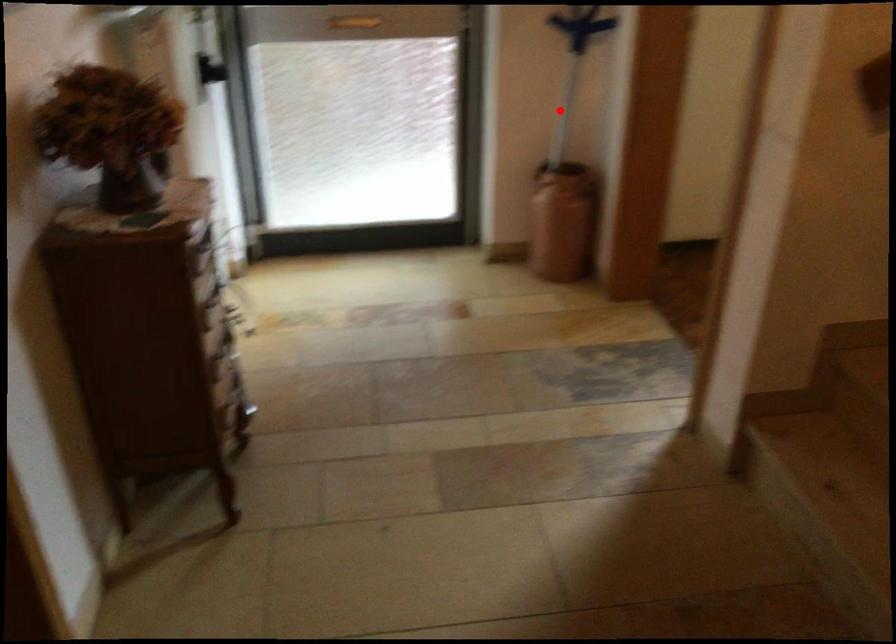
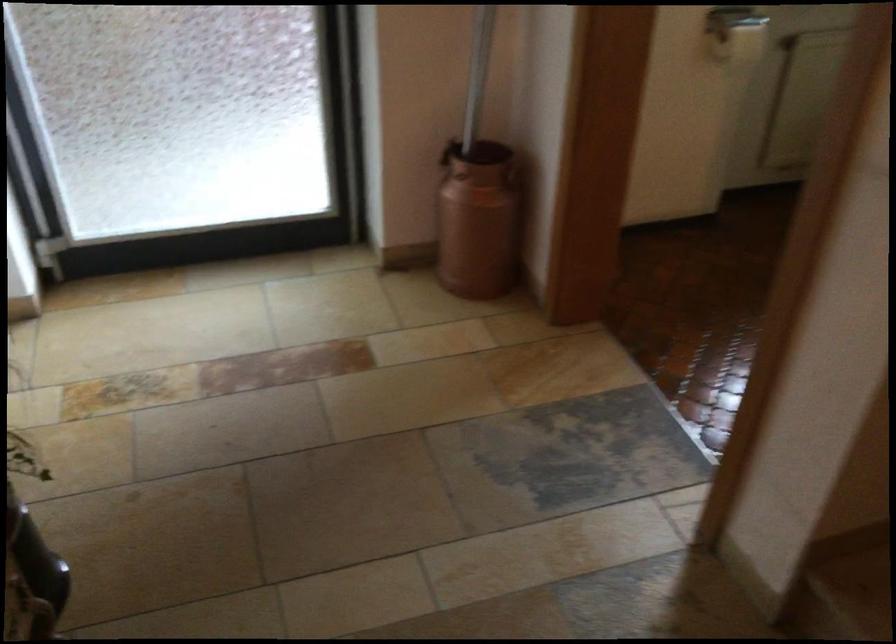
Find the pixel in the second image that matches the highlighted location in the first image.

(478, 73)